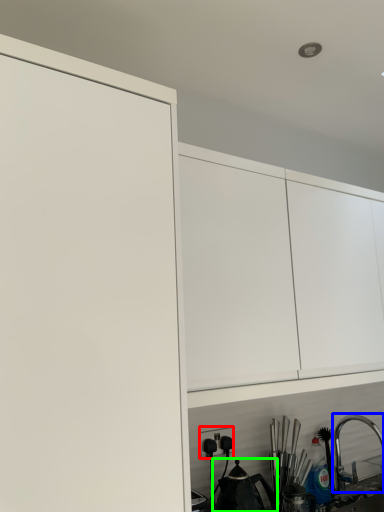
Question: Considering the real-world distances, which object is farthest from electric outlet (highlighted by a red box)? tap (highlighted by a blue box) or tea pot (highlighted by a green box)?

Choices:
 (A) tap
 (B) tea pot

Answer: (A)